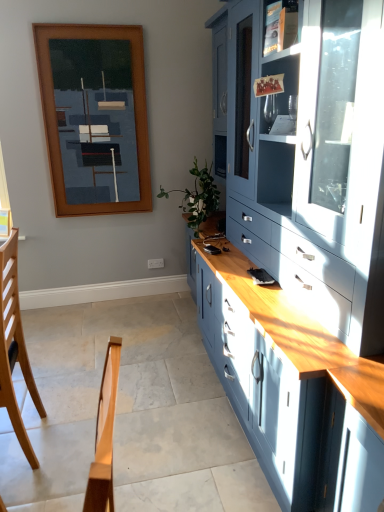
Identify the location of matte blue cabinet at right. The width and height of the screenshot is (384, 512). (313, 161).

The height and width of the screenshot is (512, 384). Identify the location of light brown wood chair at lower left. (14, 346).

Does matte glass shelf at upper right have a lesser width compared to light brown wood chair at lower left?

Yes, matte glass shelf at upper right is thinner than light brown wood chair at lower left.

Is matte glass shelf at upper right located outside light brown wood chair at lower left?

Indeed, matte glass shelf at upper right is completely outside light brown wood chair at lower left.

Is matte glass shelf at upper right directly adjacent to light brown wood chair at lower left?

matte glass shelf at upper right is not next to light brown wood chair at lower left, and they're not touching.

Which object is further away from the camera taking this photo, wooden picture frame at upper left or matte glass shelf at upper right?

wooden picture frame at upper left is further away from the camera.

Does wooden picture frame at upper left appear on the left side of matte glass shelf at upper right?

Yes.

Is wooden picture frame at upper left inside the boundaries of matte glass shelf at upper right, or outside?

wooden picture frame at upper left is not enclosed by matte glass shelf at upper right.

The height and width of the screenshot is (512, 384). What are the coordinates of `shelf above the wooden picture frame at upper left (from a real-world perspective)` in the screenshot? It's located at coord(281,25).

Identify the location of cabinetry to the right of light brown wood chair at lower left. (313, 161).

From a real-world perspective, is light brown wood chair at lower left positioned above or below matte blue cabinet at right?

light brown wood chair at lower left is situated lower than matte blue cabinet at right in the real world.

Considering the relative sizes of light brown wood chair at lower left and matte blue cabinet at right in the image provided, is light brown wood chair at lower left shorter than matte blue cabinet at right?

Yes, light brown wood chair at lower left is shorter than matte blue cabinet at right.

Is green leafy plant at center bigger than light brown wood chair at lower left?

Indeed, green leafy plant at center has a larger size compared to light brown wood chair at lower left.

Find the location of a particular element. chair on the left of the green leafy plant at center is located at coordinates (14, 346).

Which object is closer to the camera, green leafy plant at center or light brown wood chair at lower left?

light brown wood chair at lower left.

Which is closer to the camera, (4, 341) or (296, 10)?

Point (4, 341) is closer to the camera than point (296, 10).

Considering the relative sizes of light brown wood chair at lower left and matte glass shelf at upper right in the image provided, is light brown wood chair at lower left smaller than matte glass shelf at upper right?

Actually, light brown wood chair at lower left might be larger than matte glass shelf at upper right.

Is light brown wood chair at lower left positioned beyond the bounds of matte glass shelf at upper right?

Yes, light brown wood chair at lower left is not within matte glass shelf at upper right.

Considering the relative positions of light brown wood chair at lower left and matte glass shelf at upper right in the image provided, is light brown wood chair at lower left behind matte glass shelf at upper right?

No, the depth of light brown wood chair at lower left is less than that of matte glass shelf at upper right.

How far apart are green leafy plant at center and wooden picture frame at upper left?

green leafy plant at center and wooden picture frame at upper left are 37.30 inches apart.

Is green leafy plant at center oriented away from wooden picture frame at upper left?

No, wooden picture frame at upper left is not at the back of green leafy plant at center.

Is green leafy plant at center beside wooden picture frame at upper left?

They are not placed beside each other.

Is point (208, 167) closer to camera compared to point (108, 118)?

No.

Which is more to the right, green leafy plant at center or matte blue cabinet at right?

From the viewer's perspective, matte blue cabinet at right appears more on the right side.

Based on the photo, which object is further away from the camera taking this photo, green leafy plant at center or matte blue cabinet at right?

green leafy plant at center is behind.

From a real-world perspective, is green leafy plant at center located higher than matte blue cabinet at right?

No, from a real-world perspective, green leafy plant at center is not on top of matte blue cabinet at right.

Locate an element on the screen. shelf that is above the light brown wood chair at lower left (from the image's perspective) is located at coordinates (281, 25).

Locate an element on the screen. The image size is (384, 512). picture frame that is behind the matte glass shelf at upper right is located at coordinates (95, 117).

Estimate the real-world distances between objects in this image. Which object is closer to green leafy plant at center, matte blue cabinet at right or matte glass shelf at upper right?

The object closer to green leafy plant at center is matte blue cabinet at right.

From the image, which object appears to be farther from light brown wood chair at lower left, wooden picture frame at upper left or green leafy plant at center?

wooden picture frame at upper left lies further to light brown wood chair at lower left than the other object.

Considering their positions, is green leafy plant at center positioned closer to matte blue cabinet at right than matte glass shelf at upper right?

Among the two, matte glass shelf at upper right is located nearer to matte blue cabinet at right.

Based on the photo, based on their spatial positions, is light brown wood chair at lower left or matte glass shelf at upper right further from green leafy plant at center?

light brown wood chair at lower left.

Estimate the real-world distances between objects in this image. Which object is further from matte glass shelf at upper right, light brown wood chair at lower left or matte blue cabinet at right?

The object further to matte glass shelf at upper right is light brown wood chair at lower left.

Which object lies further to the anchor point matte glass shelf at upper right, matte blue cabinet at right or light brown wood chair at lower left?

light brown wood chair at lower left is positioned further to the anchor matte glass shelf at upper right.

Based on their spatial positions, is light brown wood chair at lower left or wooden picture frame at upper left further from matte glass shelf at upper right?

Based on the image, wooden picture frame at upper left appears to be further to matte glass shelf at upper right.

Looking at this image, estimate the real-world distances between objects in this image. Which object is closer to wooden picture frame at upper left, light brown wood chair at lower left or green leafy plant at center?

Based on the image, green leafy plant at center appears to be nearer to wooden picture frame at upper left.

Where is `chair located between matte blue cabinet at right and green leafy plant at center in the depth direction`? The width and height of the screenshot is (384, 512). chair located between matte blue cabinet at right and green leafy plant at center in the depth direction is located at coordinates (14, 346).

Locate an element on the screen. The height and width of the screenshot is (512, 384). shelf positioned between matte blue cabinet at right and wooden picture frame at upper left from near to far is located at coordinates (281, 25).

Find the location of a particular element. Image resolution: width=384 pixels, height=512 pixels. chair positioned between matte blue cabinet at right and matte glass shelf at upper right from near to far is located at coordinates (14, 346).

At what (x,y) coordinates should I click in order to perform the action: click on plant positioned between matte glass shelf at upper right and wooden picture frame at upper left from near to far. Please return your answer as a coordinate pair (x, y). Image resolution: width=384 pixels, height=512 pixels. Looking at the image, I should click on (197, 197).